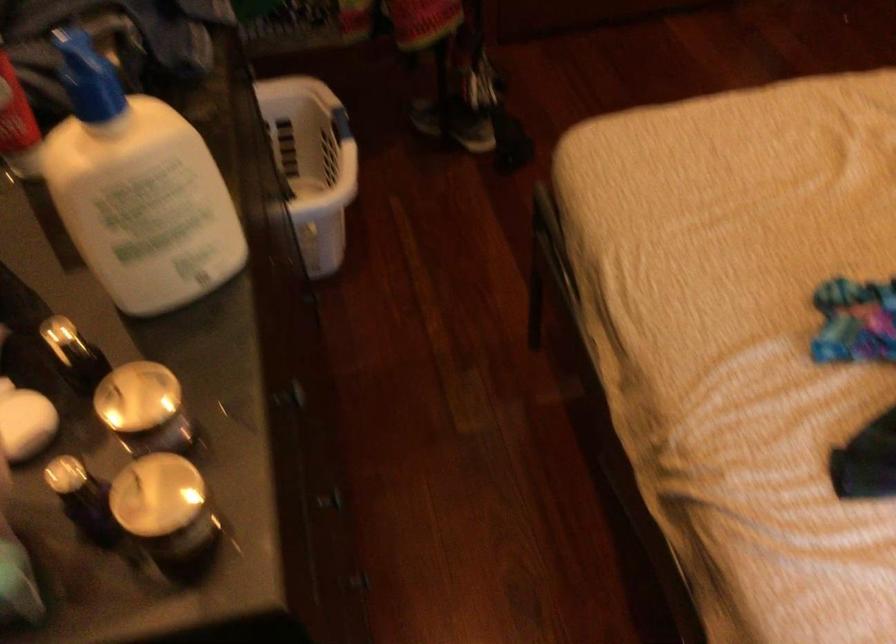
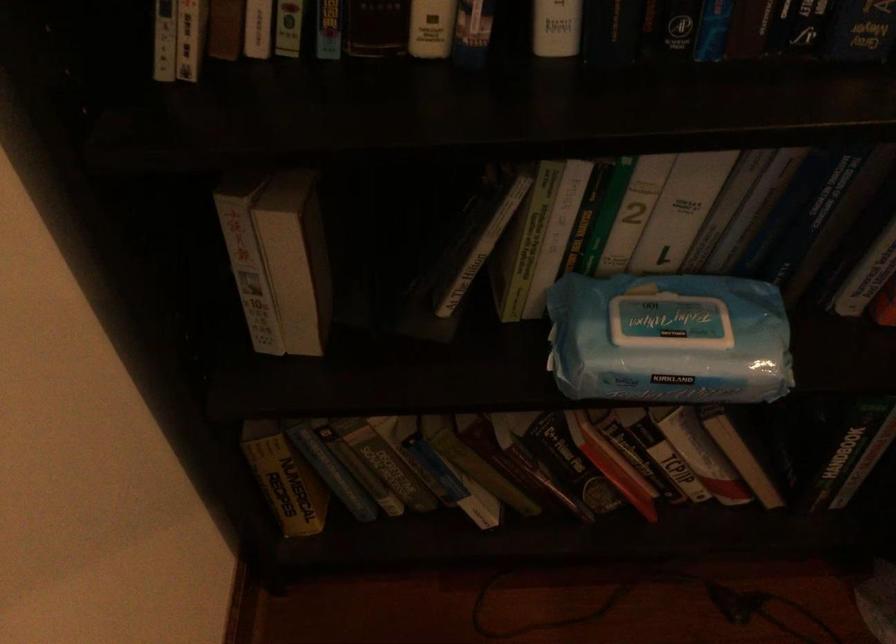
First-person continuous shooting, in which direction is the camera rotating?

The camera rotated toward left-down.